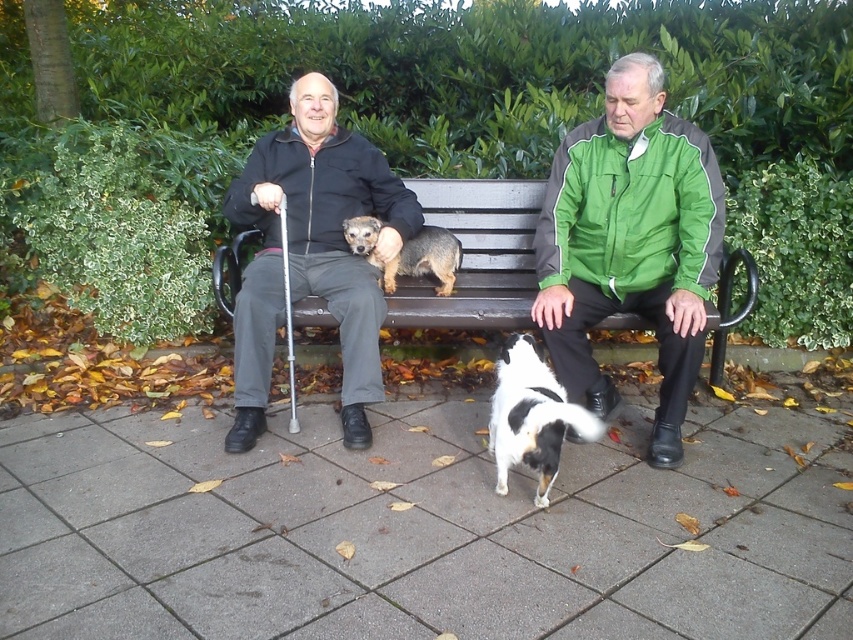
Question: Among these objects, which one is farthest from the camera?

Choices:
 (A) black matte jacket at center
 (B) wooden bench at center

Answer: (B)

Question: Which of these objects is positioned closest to the black and white fur dog at center?

Choices:
 (A) green fabric jacket at right
 (B) black matte jacket at center
 (C) wooden bench at center
 (D) matte black jacket at center

Answer: (D)

Question: Is matte black jacket at center smaller than brown textured dog at center?

Choices:
 (A) no
 (B) yes

Answer: (A)

Question: Does matte black jacket at center appear over brown textured dog at center?

Choices:
 (A) yes
 (B) no

Answer: (B)

Question: Does green fabric jacket at right appear over black and white fur dog at center?

Choices:
 (A) yes
 (B) no

Answer: (A)

Question: Estimate the real-world distances between objects in this image. Which object is closer to the brown textured dog at center?

Choices:
 (A) green fabric jacket at right
 (B) matte black jacket at center
 (C) wooden bench at center
 (D) black and white fur dog at center

Answer: (C)